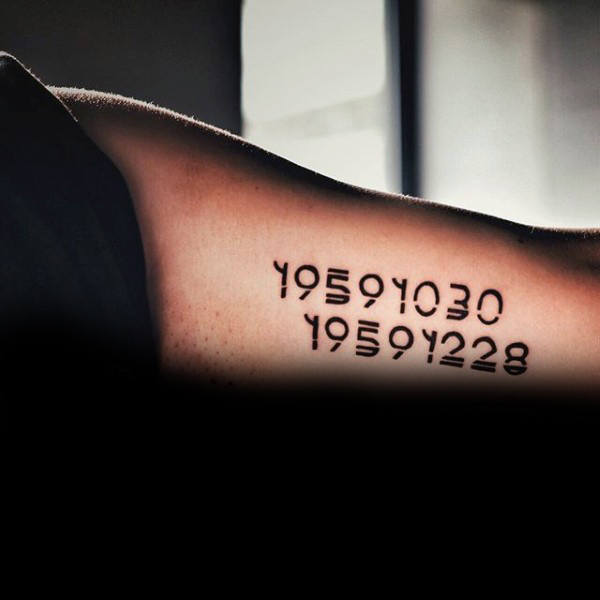
Image resolution: width=600 pixels, height=600 pixels. I want to click on wall, so click(x=326, y=87).